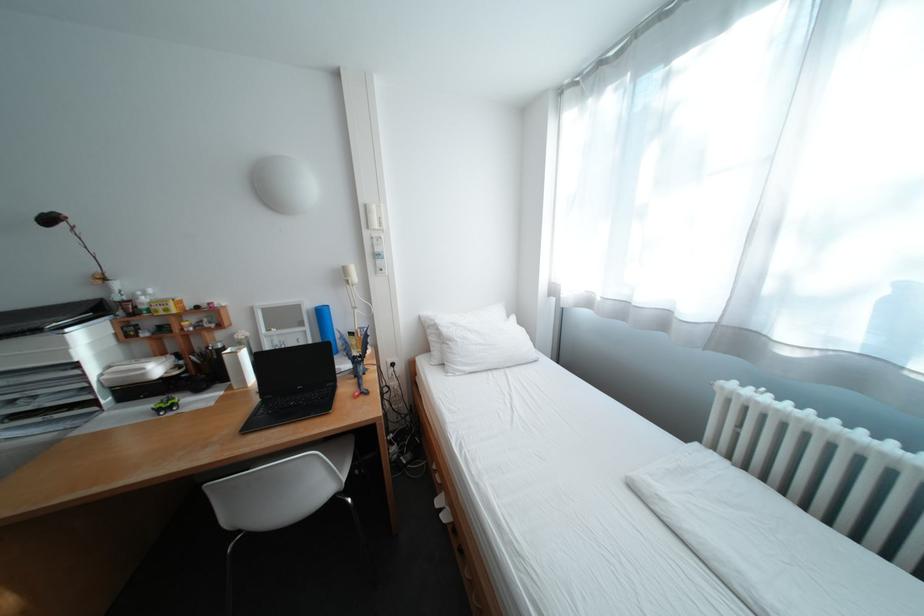
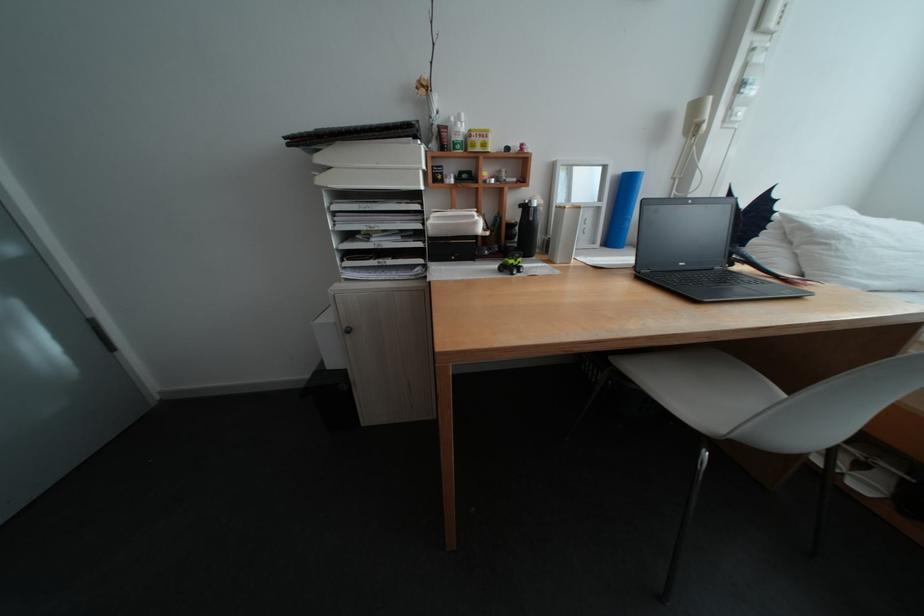
Locate, in the second image, the point that corresponds to [320,329] in the first image.

(616, 205)